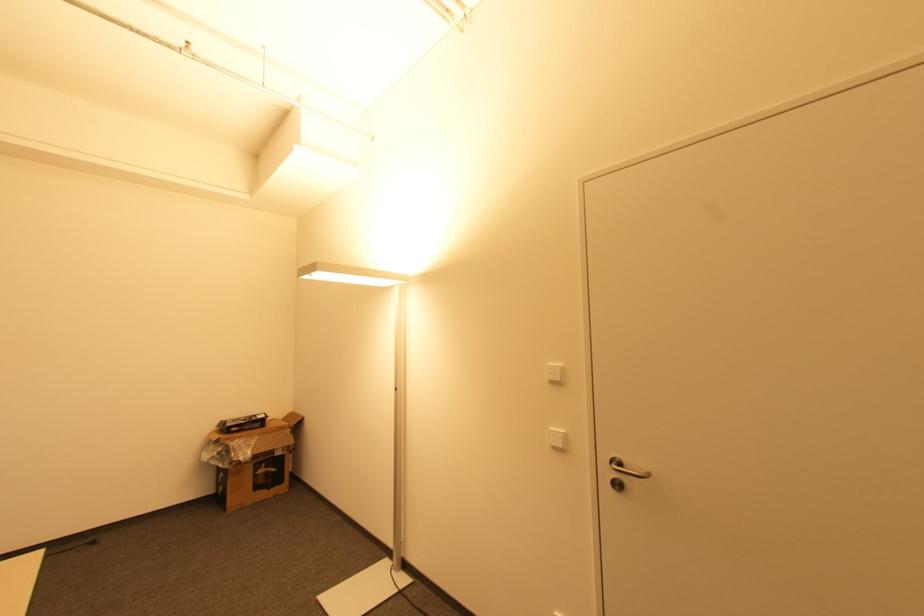
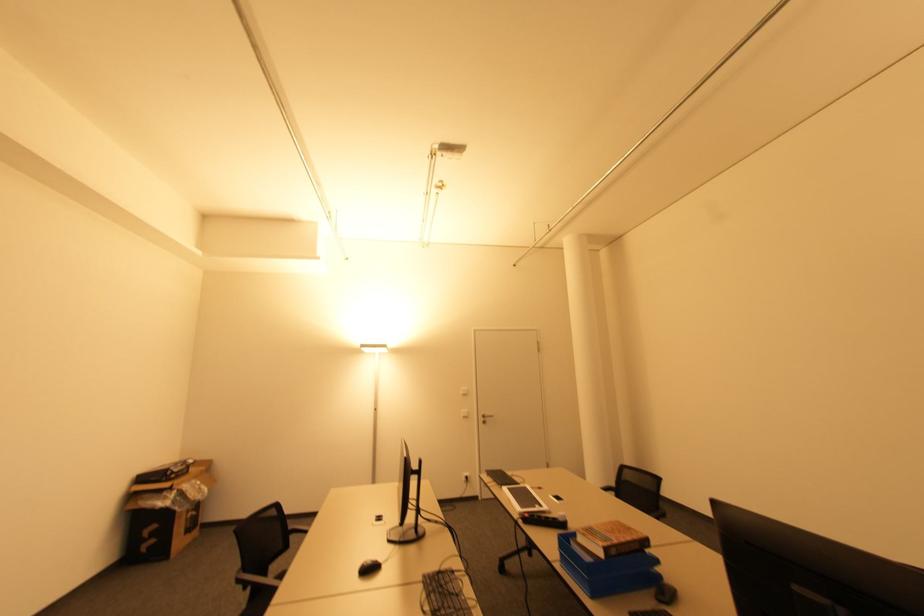
In the second image, find the point that corresponds to pixel 557 448 in the first image.

(467, 416)